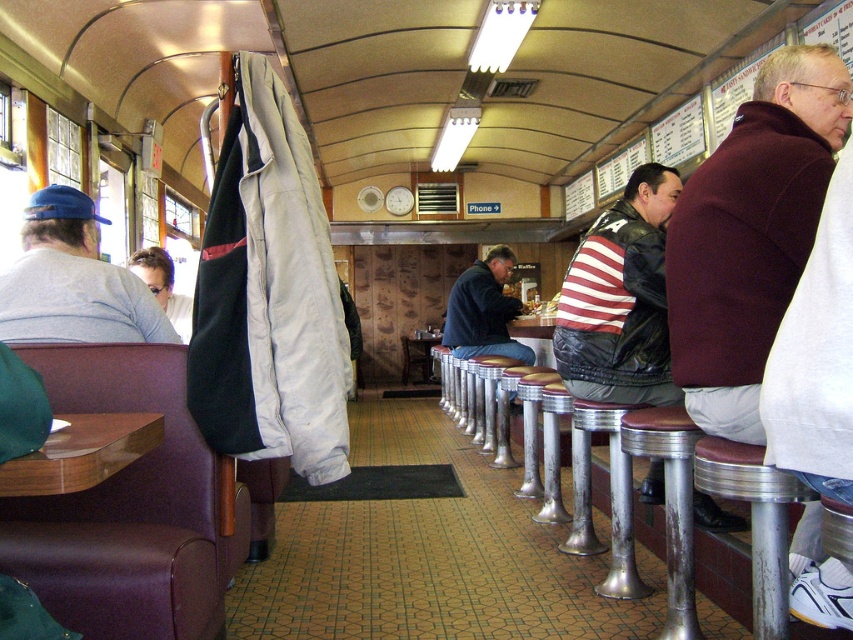
Question: Is striped leather jacket at center smaller than dark blue leather jacket at center?

Choices:
 (A) no
 (B) yes

Answer: (B)

Question: Is metallic silver bar stool at lower right to the right of dark blue leather jacket at center from the viewer's perspective?

Choices:
 (A) no
 (B) yes

Answer: (B)

Question: Which object appears closest to the camera in this image?

Choices:
 (A) wooden table at lower left
 (B) dark blue leather jacket at center
 (C) metallic silver bar stool at lower right

Answer: (A)

Question: Which of the following is the closest to the observer?

Choices:
 (A) gray cotton shirt at left
 (B) metallic silver table at center

Answer: (A)

Question: Is metallic silver bar stool at lower right above metallic silver table at center?

Choices:
 (A) no
 (B) yes

Answer: (A)

Question: Estimate the real-world distances between objects in this image. Which object is farther from the brushed metal table at center?

Choices:
 (A) striped leather jacket at center
 (B) gray cotton shirt at left

Answer: (B)